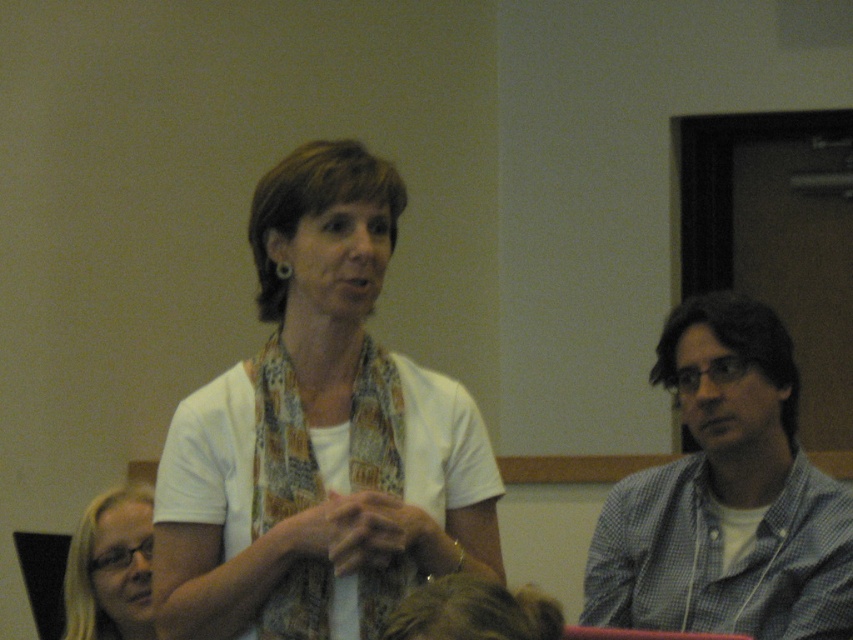
Which of these two, white matte scarf at center or checkered fabric shirt at right, stands shorter?

With less height is checkered fabric shirt at right.

Does white matte scarf at center lie behind checkered fabric shirt at right?

That is False.

What do you see at coordinates (318, 435) in the screenshot? This screenshot has height=640, width=853. I see `white matte scarf at center` at bounding box center [318, 435].

Image resolution: width=853 pixels, height=640 pixels. What are the coordinates of `white matte scarf at center` in the screenshot? It's located at (318, 435).

Can you confirm if white matte scarf at center is positioned below matte black glasses at lower left?

No, white matte scarf at center is not below matte black glasses at lower left.

Does point (312, 276) come in front of point (135, 500)?

Yes, point (312, 276) is closer to viewer.

At what (x,y) coordinates should I click in order to perform the action: click on white matte scarf at center. Please return your answer as a coordinate pair (x, y). This screenshot has height=640, width=853. Looking at the image, I should click on (318, 435).

Can you confirm if checkered fabric shirt at right is positioned above matte black glasses at lower left?

Yes, checkered fabric shirt at right is above matte black glasses at lower left.

The height and width of the screenshot is (640, 853). I want to click on checkered fabric shirt at right, so click(726, 497).

Find the location of a particular element. The height and width of the screenshot is (640, 853). checkered fabric shirt at right is located at coordinates (726, 497).

I want to click on checkered fabric shirt at right, so click(x=726, y=497).